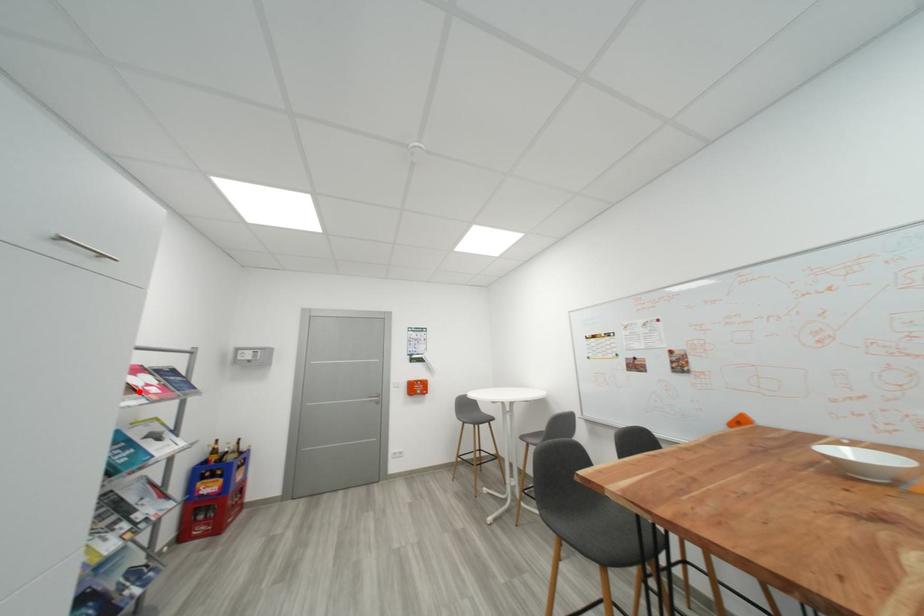
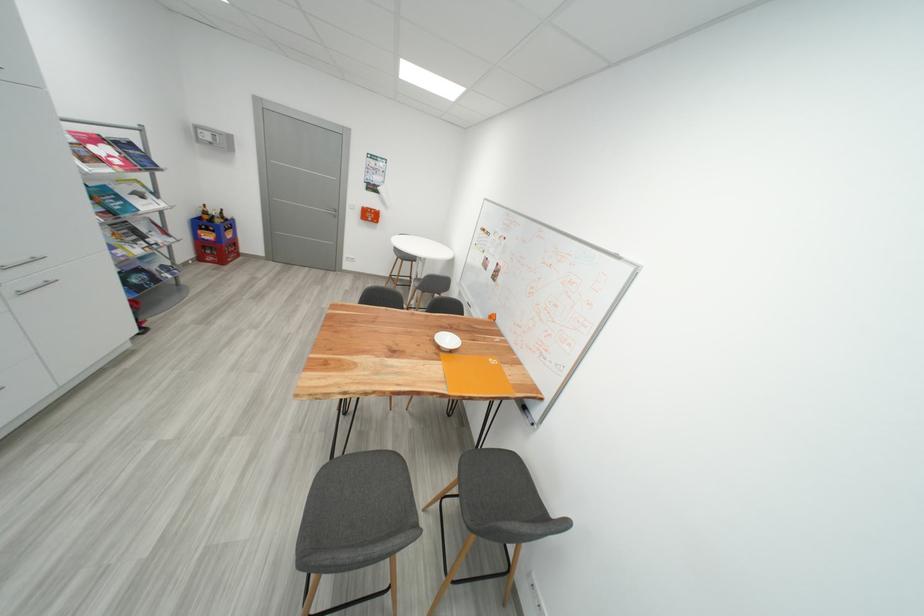
Where in the second image is the point corresponding to the highlighted location from the first image?

(104, 161)